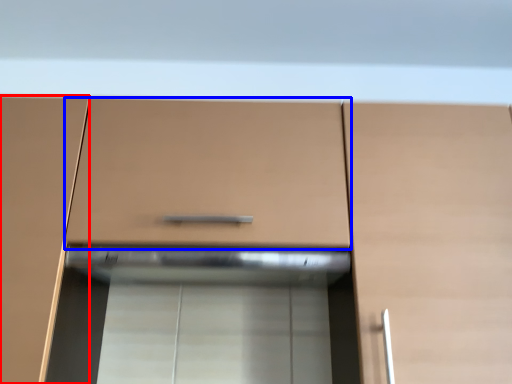
Question: Which object is further to the camera taking this photo, cabinetry (highlighted by a red box) or drawer (highlighted by a blue box)?

Choices:
 (A) cabinetry
 (B) drawer

Answer: (B)